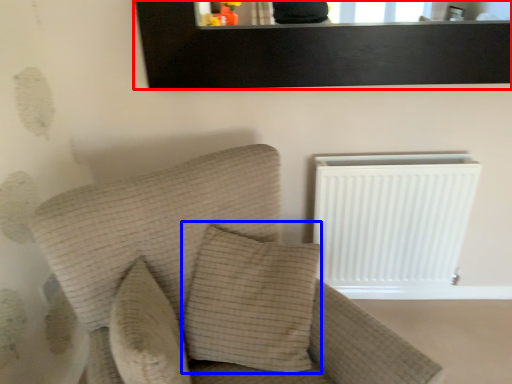
Question: Which object appears farthest to the camera in this image, picture frame (highlighted by a red box) or pillow (highlighted by a blue box)?

Choices:
 (A) picture frame
 (B) pillow

Answer: (A)